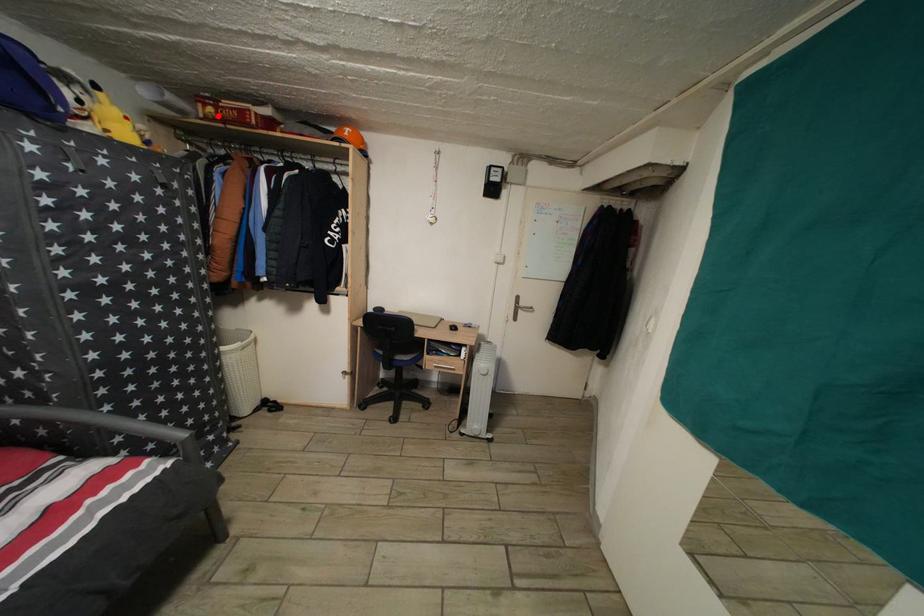
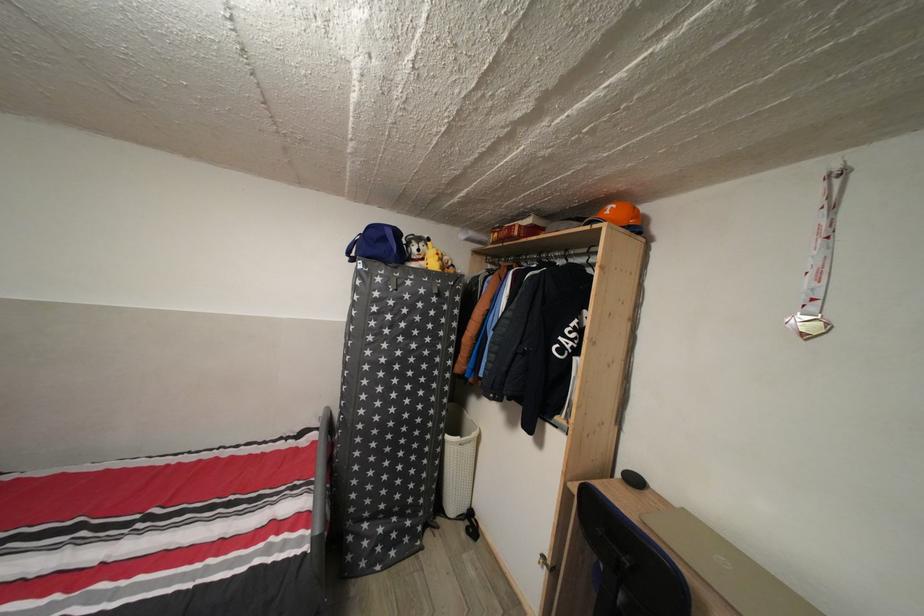
The point at the highlighted location is marked in the first image. Where is the corresponding point in the second image?

(503, 241)